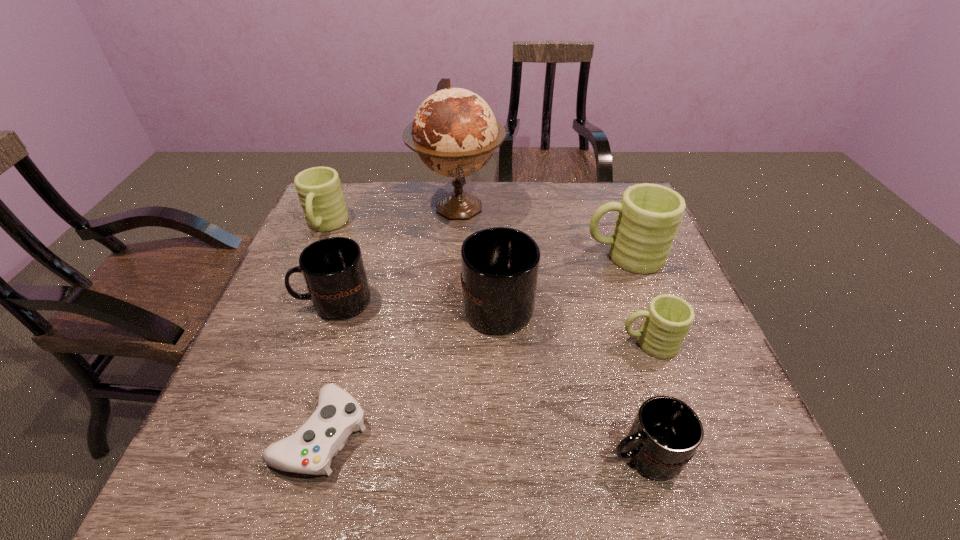
You are a GUI agent. You are given a task and a screenshot of the screen. Output one action in this format:
    pyautogui.click(x=<x>, y=<y>)
    Task: Click on the globe
    
    Given the screenshot: What is the action you would take?
    pyautogui.click(x=454, y=132)

Locate an element on the screen. Image resolution: width=960 pixels, height=540 pixels. the biggest green mug is located at coordinates (649, 215).

Locate an element on the screen. The image size is (960, 540). the biggest black mug is located at coordinates (500, 265).

This screenshot has height=540, width=960. In order to click on the second black mug from left to right in this screenshot , I will do `click(500, 265)`.

The width and height of the screenshot is (960, 540). Identify the location of the second smallest green mug. (320, 194).

You are a GUI agent. You are given a task and a screenshot of the screen. Output one action in this format:
    pyautogui.click(x=<x>, y=<y>)
    Task: Click on the leftmost black mug
    
    Given the screenshot: What is the action you would take?
    pyautogui.click(x=333, y=269)

Where is `the smallest green mug`? Image resolution: width=960 pixels, height=540 pixels. the smallest green mug is located at coordinates (668, 318).

The image size is (960, 540). In order to click on the nearest black mug in this screenshot , I will do `click(666, 432)`.

Find the location of a particular element. The image size is (960, 540). the smallest black mug is located at coordinates (666, 432).

Image resolution: width=960 pixels, height=540 pixels. Find the location of `control`. control is located at coordinates (310, 450).